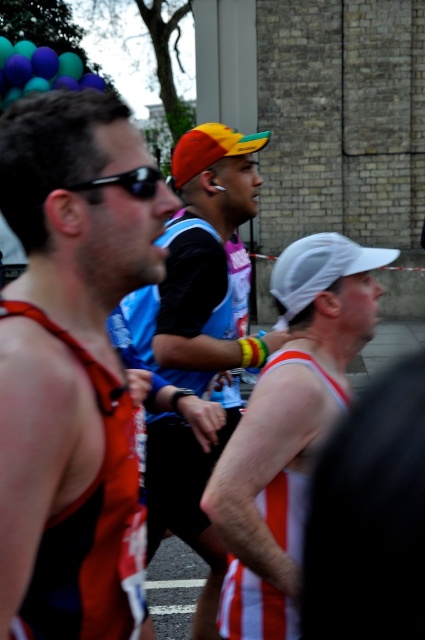
Based on the photo, you are a photographer trying to capture a closeup shot of the matte orange tank top at left and the black plastic sunglasses at upper left. Since you want to focus on both objects, which one should you zoom in on more to ensure they are both in focus?

The matte orange tank top at left is bigger than the black plastic sunglasses at upper left, so you should zoom in more on the matte orange tank top at left to ensure both are in focus.